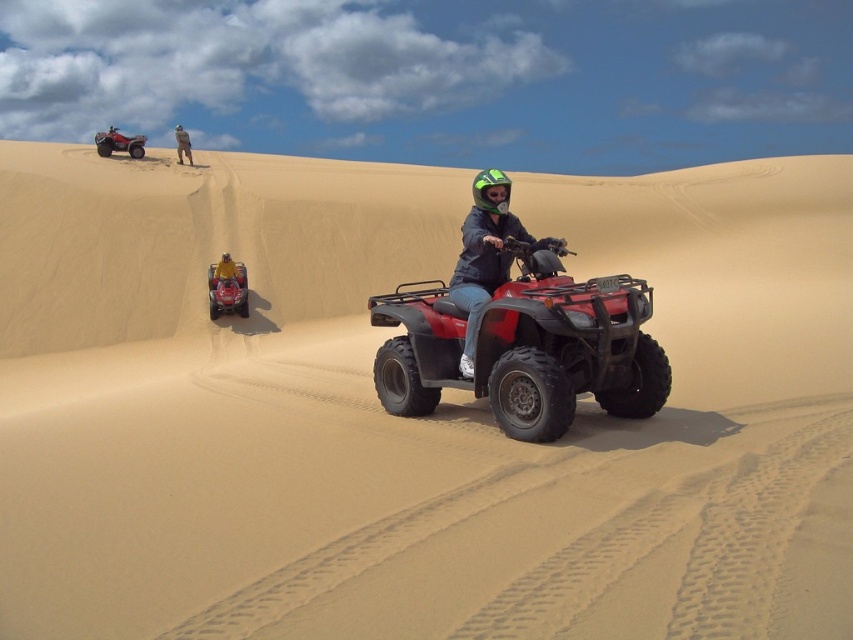
Question: Is matte black helmet at center thinner than shiny black helmet at center?

Choices:
 (A) yes
 (B) no

Answer: (B)

Question: Which point is closer to the camera taking this photo?

Choices:
 (A) (486, 342)
 (B) (476, 225)
 (C) (187, 154)

Answer: (A)

Question: Among these objects, which one is farthest from the camera?

Choices:
 (A) matte red quad bike at upper left
 (B) matte black helmet at center

Answer: (A)

Question: Is matte black helmet at center further to camera compared to camouflage fabric jacket at upper center?

Choices:
 (A) yes
 (B) no

Answer: (B)

Question: Does camouflage fabric jacket at upper center appear on the right side of green matte helmet at center?

Choices:
 (A) no
 (B) yes

Answer: (A)

Question: Based on their relative distances, which object is nearer to the matte black helmet at center?

Choices:
 (A) shiny red quad bike at center
 (B) shiny black helmet at center
 (C) camouflage fabric jacket at upper center
 (D) matte red quad bike at upper left

Answer: (B)